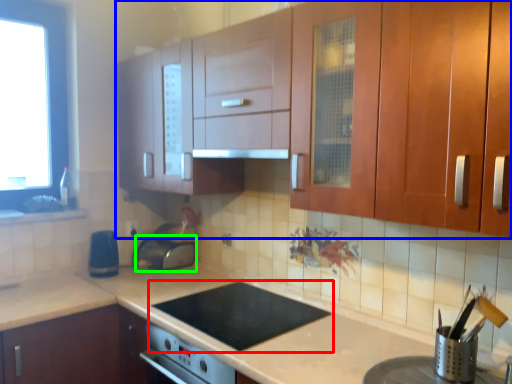
Question: Considering the real-world distances, which object is closest to gas stove (highlighted by a red box)? cabinetry (highlighted by a blue box) or appliance (highlighted by a green box).

Choices:
 (A) cabinetry
 (B) appliance

Answer: (B)